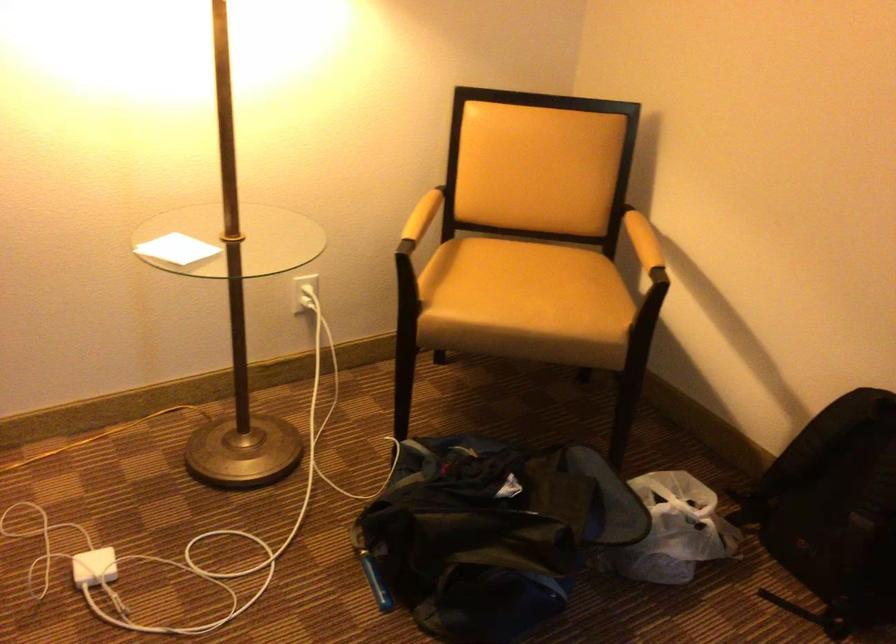
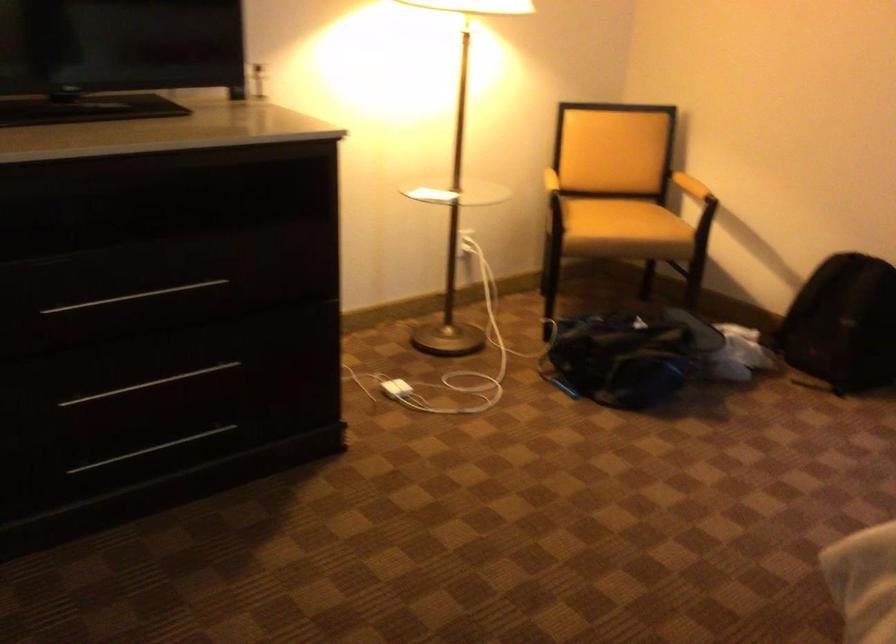
Locate, in the second image, the point that corresponds to the point at 478,554 in the first image.

(627, 355)